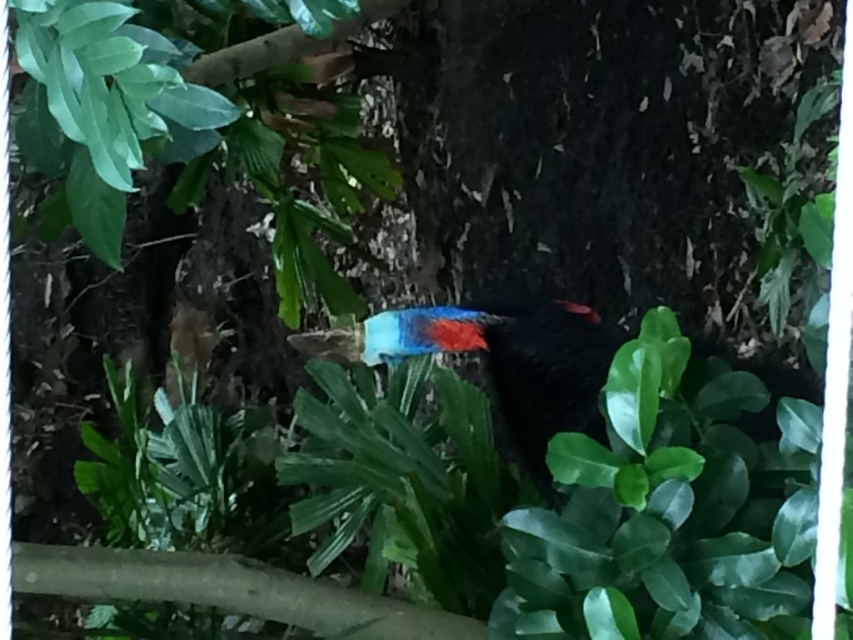
Is shiny blue and red feathers at center shorter than smooth brown branch at lower left?

No, shiny blue and red feathers at center is not shorter than smooth brown branch at lower left.

Who is more forward, (515,448) or (67,572)?

Point (67,572) is more forward.

Who is more forward, (375, 323) or (366, 604)?

Point (366, 604) is more forward.

Find the location of a particular element. This screenshot has height=640, width=853. shiny blue and red feathers at center is located at coordinates (503, 362).